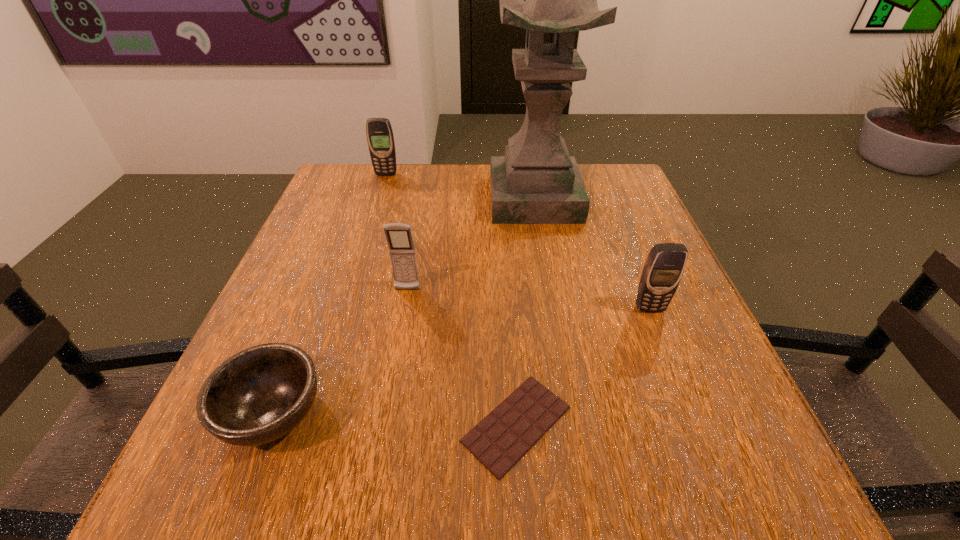
Locate an element on the screen. cellular telephone that is at the left edge is located at coordinates (380, 138).

You are a GUI agent. You are given a task and a screenshot of the screen. Output one action in this format:
    pyautogui.click(x=<x>, y=<y>)
    Task: Click on the bowl that is at the left edge
    
    Given the screenshot: What is the action you would take?
    pyautogui.click(x=260, y=394)

This screenshot has height=540, width=960. Find the location of `sculpture that is at the right edge`. sculpture that is at the right edge is located at coordinates (537, 182).

In order to click on cellular telephone that is at the right edge in this screenshot , I will do `click(664, 267)`.

Locate an element on the screen. The height and width of the screenshot is (540, 960). object positioned at the far left corner is located at coordinates (380, 138).

Image resolution: width=960 pixels, height=540 pixels. In order to click on object that is positioned at the near left corner in this screenshot , I will do `click(260, 394)`.

Locate an element on the screen. object at the far right corner is located at coordinates (537, 182).

This screenshot has height=540, width=960. In the image, there is a desktop. Identify the location of free space at the far edge. (403, 163).

In order to click on free space at the near edge of the desktop in this screenshot , I will do `click(312, 484)`.

In the image, there is a desktop. What are the coordinates of `free space at the left edge` in the screenshot? It's located at (323, 393).